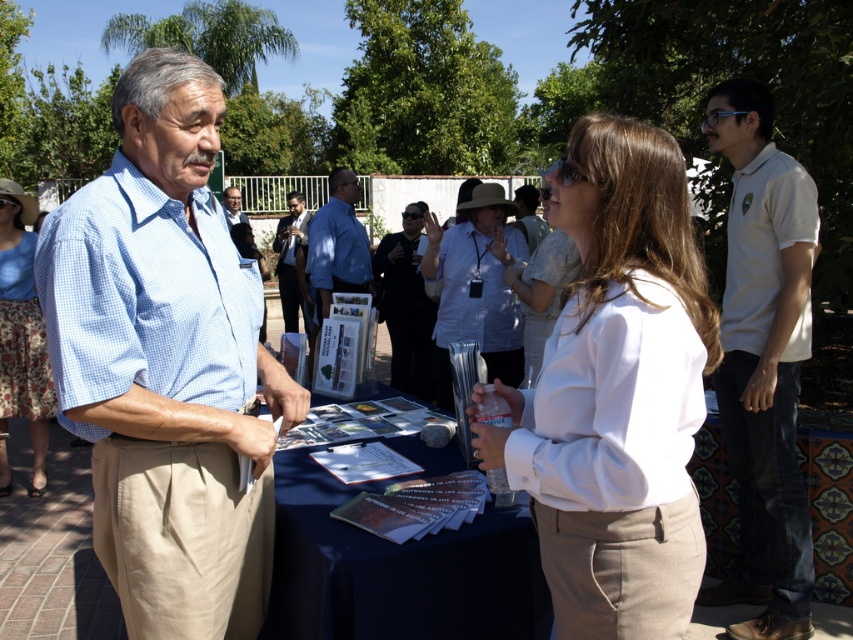
You are a photographer trying to capture the woman wearing the white cotton blouse at center. Based on the coordinates provided in the Objects Description, where should you position your camera to ensure she is centered in the frame?

The white cotton blouse at center is located at point coordinates (x=618, y=394). To center her in the frame, position the camera so that the crosshairs align with these coordinates.